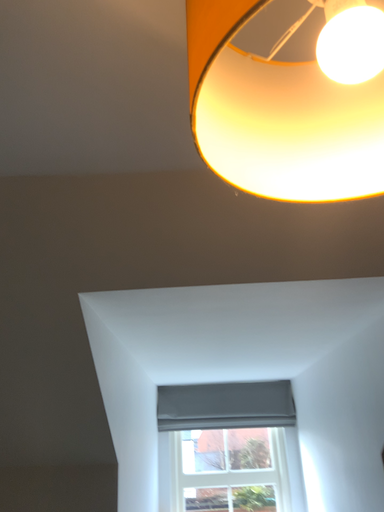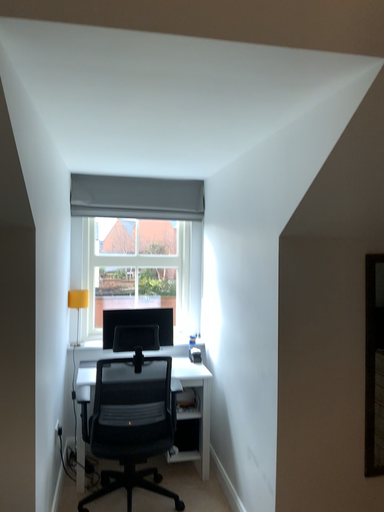
Question: How did the camera likely rotate when shooting the video?

Choices:
 (A) rotated right
 (B) rotated left

Answer: (A)